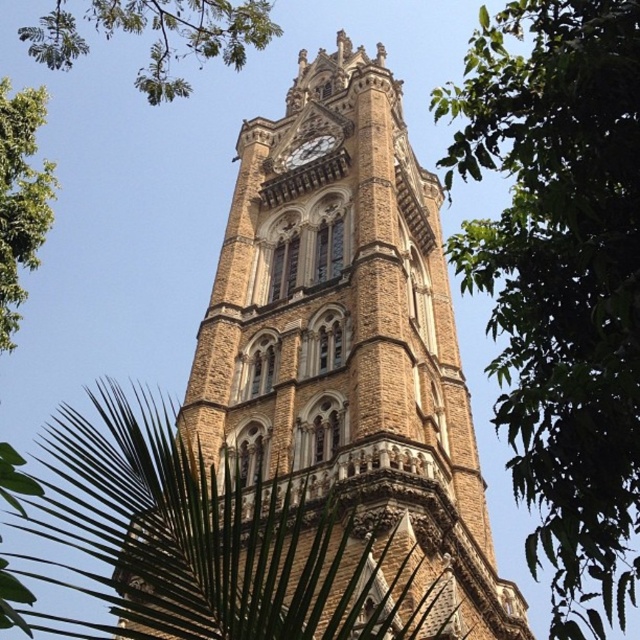
Who is higher up, brown stone clock tower at center or green leafy tree at left?

brown stone clock tower at center

Is point (346, 202) behind point (26, 92)?

Yes.

What do you see at coordinates (349, 337) in the screenshot? I see `brown stone clock tower at center` at bounding box center [349, 337].

Where is `brown stone clock tower at center`? The height and width of the screenshot is (640, 640). brown stone clock tower at center is located at coordinates (349, 337).

Describe the element at coordinates (349, 337) in the screenshot. The width and height of the screenshot is (640, 640). I see `brown stone clock tower at center` at that location.

Can you confirm if brown stone clock tower at center is positioned to the left of gold textured clock at center?

No, brown stone clock tower at center is not to the left of gold textured clock at center.

What do you see at coordinates (349, 337) in the screenshot? I see `brown stone clock tower at center` at bounding box center [349, 337].

Where is `brown stone clock tower at center`? The width and height of the screenshot is (640, 640). brown stone clock tower at center is located at coordinates (349, 337).

Does green leafy tree at right have a greater width compared to green leafy tree at upper left?

Incorrect, green leafy tree at right's width does not surpass green leafy tree at upper left's.

Who is higher up, green leafy tree at right or green leafy tree at upper left?

Positioned higher is green leafy tree at upper left.

What do you see at coordinates (561, 282) in the screenshot?
I see `green leafy tree at right` at bounding box center [561, 282].

Image resolution: width=640 pixels, height=640 pixels. I want to click on green leafy tree at right, so click(561, 282).